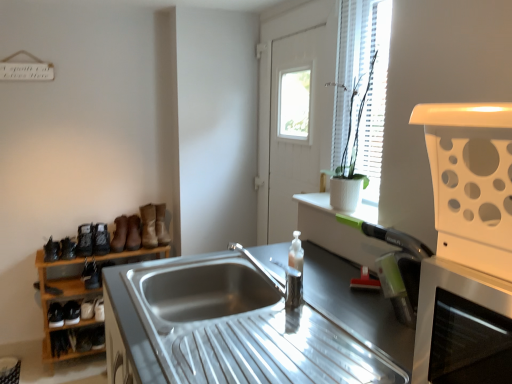
Question: Is black leather shoe at lower left, positioned as the second shoe in bottom-to-top order, far from matte black shoe at left, which is counted as the fifth shoe, starting from the bottom?

Choices:
 (A) no
 (B) yes

Answer: (A)

Question: Can you confirm if black leather shoe at lower left, which is the 4th shoe from top to bottom, is positioned to the left of matte black shoe at left, which is counted as the fifth shoe, starting from the bottom?

Choices:
 (A) no
 (B) yes

Answer: (B)

Question: Is black leather shoe at lower left, positioned as the second shoe in bottom-to-top order, shorter than matte black shoe at left, which is counted as the fifth shoe, starting from the bottom?

Choices:
 (A) no
 (B) yes

Answer: (B)

Question: From the image's perspective, is black leather shoe at lower left, positioned as the second shoe in bottom-to-top order, located beneath matte black shoe at left, the first shoe viewed from the top?

Choices:
 (A) no
 (B) yes

Answer: (B)

Question: Can you confirm if black leather shoe at lower left, positioned as the second shoe in bottom-to-top order, is smaller than matte black shoe at left, which is counted as the fifth shoe, starting from the bottom?

Choices:
 (A) no
 (B) yes

Answer: (A)

Question: From the image's perspective, is black leather shoe at lower left, positioned as the second shoe in bottom-to-top order, positioned above or below leather shoe at lower left, the 5th shoe viewed from the top?

Choices:
 (A) above
 (B) below

Answer: (A)

Question: Is black leather shoe at lower left, positioned as the second shoe in bottom-to-top order, situated inside leather shoe at lower left, which is counted as the first shoe, starting from the bottom, or outside?

Choices:
 (A) inside
 (B) outside

Answer: (B)

Question: Looking at their shapes, would you say black leather shoe at lower left, which is the 4th shoe from top to bottom, is wider or thinner than leather shoe at lower left, the 5th shoe viewed from the top?

Choices:
 (A) thin
 (B) wide

Answer: (B)

Question: Would you say black leather shoe at lower left, positioned as the second shoe in bottom-to-top order, is to the left or to the right of leather shoe at lower left, which is counted as the first shoe, starting from the bottom, in the picture?

Choices:
 (A) left
 (B) right

Answer: (A)

Question: From their relative heights in the image, would you say leather boot at left, which is the first boot in right-to-left order, is taller or shorter than stainless steel sink at center?

Choices:
 (A) tall
 (B) short

Answer: (A)

Question: Considering their positions, is leather boot at left, which is the first boot in right-to-left order, located in front of or behind stainless steel sink at center?

Choices:
 (A) front
 (B) behind

Answer: (B)

Question: Is leather boot at left, which appears as the 7th boot when viewed from the left, wider or thinner than stainless steel sink at center?

Choices:
 (A) thin
 (B) wide

Answer: (A)

Question: Would you say leather boot at left, which is the first boot in right-to-left order, is to the left or to the right of stainless steel sink at center in the picture?

Choices:
 (A) left
 (B) right

Answer: (A)

Question: Is wooden shoe rack at left inside or outside of brown suede boot at lower left, the fifth boot in the left-to-right sequence?

Choices:
 (A) outside
 (B) inside

Answer: (A)

Question: Considering the positions of wooden shoe rack at left and brown suede boot at lower left, which is the 3th boot from right to left, in the image, is wooden shoe rack at left bigger or smaller than brown suede boot at lower left, which is the 3th boot from right to left,?

Choices:
 (A) big
 (B) small

Answer: (A)